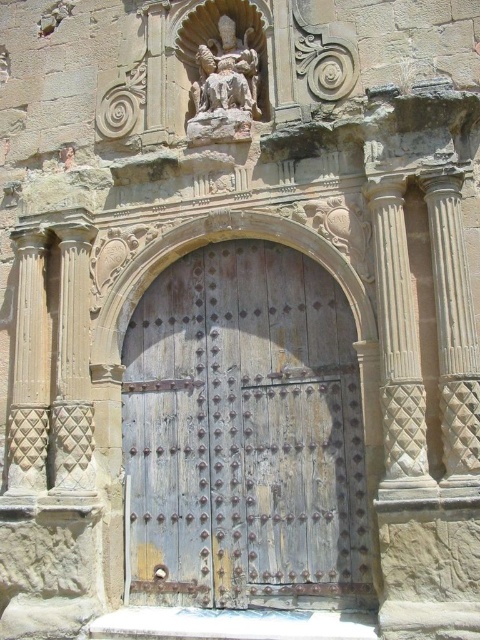
Does weathered wood door at center appear on the right side of white textured column at right?

Incorrect, weathered wood door at center is not on the right side of white textured column at right.

Is point (228, 269) closer to viewer compared to point (407, 436)?

That is False.

Identify the location of weathered wood door at center. This screenshot has width=480, height=640. (244, 435).

The image size is (480, 640). I want to click on weathered wood door at center, so click(x=244, y=435).

Is smooth stone column at right positioned behind carved stone statue at upper center?

No, smooth stone column at right is in front of carved stone statue at upper center.

Does smooth stone column at right have a larger size compared to carved stone statue at upper center?

Yes, smooth stone column at right is bigger than carved stone statue at upper center.

The height and width of the screenshot is (640, 480). I want to click on smooth stone column at right, so click(454, 330).

Is point (333, 445) closer to camera compared to point (204, 61)?

Yes, point (333, 445) is in front of point (204, 61).

Is weathered wood door at center behind carved stone statue at upper center?

No, it is not.

This screenshot has width=480, height=640. What do you see at coordinates (244, 435) in the screenshot?
I see `weathered wood door at center` at bounding box center [244, 435].

I want to click on weathered wood door at center, so click(244, 435).